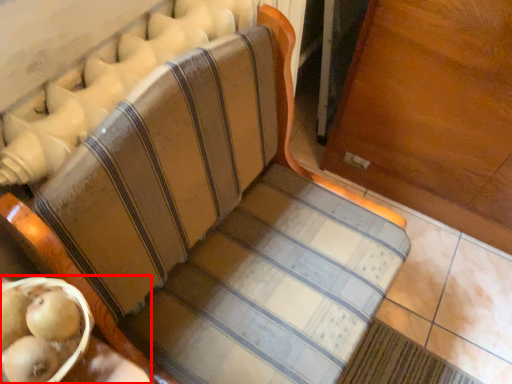
Question: From the image's perspective, where is table (annotated by the red box) located in relation to fruit in the image?

Choices:
 (A) above
 (B) below

Answer: (B)